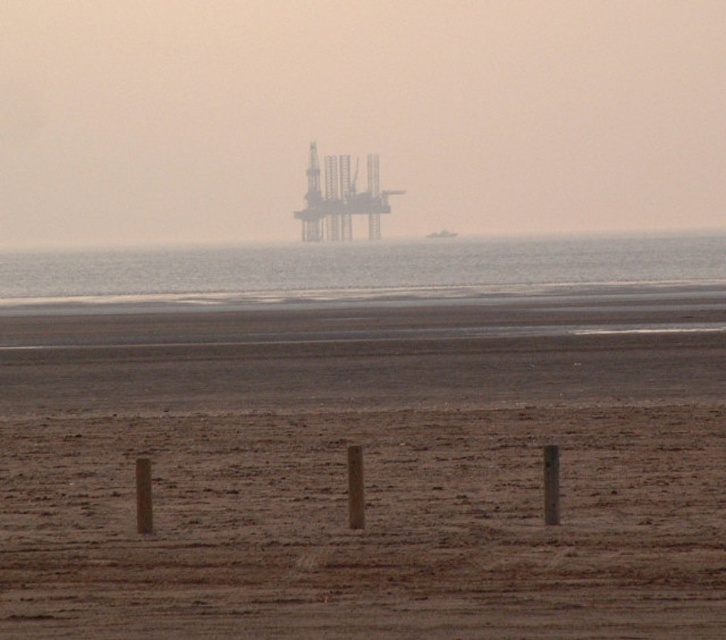
You are a photographer planning to capture the reflection of the sky in the transparent water at center. Since the brown sandy beach at lower center is in the way, can you adjust your position to avoid it while still framing the water?

The brown sandy beach at lower center is shorter than the transparent water at center, so you can lower your camera angle or move closer to the water to avoid the beach blocking the reflection.

You are standing at the center of the image and want to walk to the brown sandy beach at lower center. Which direction should you move?

You should move downward because the brown sandy beach at lower center is located below your current position at the center of the image.